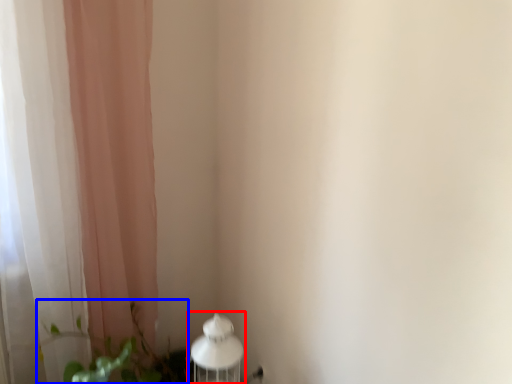
Question: Which object is closer to the camera taking this photo, table lamp (highlighted by a red box) or plant (highlighted by a blue box)?

Choices:
 (A) table lamp
 (B) plant

Answer: (B)